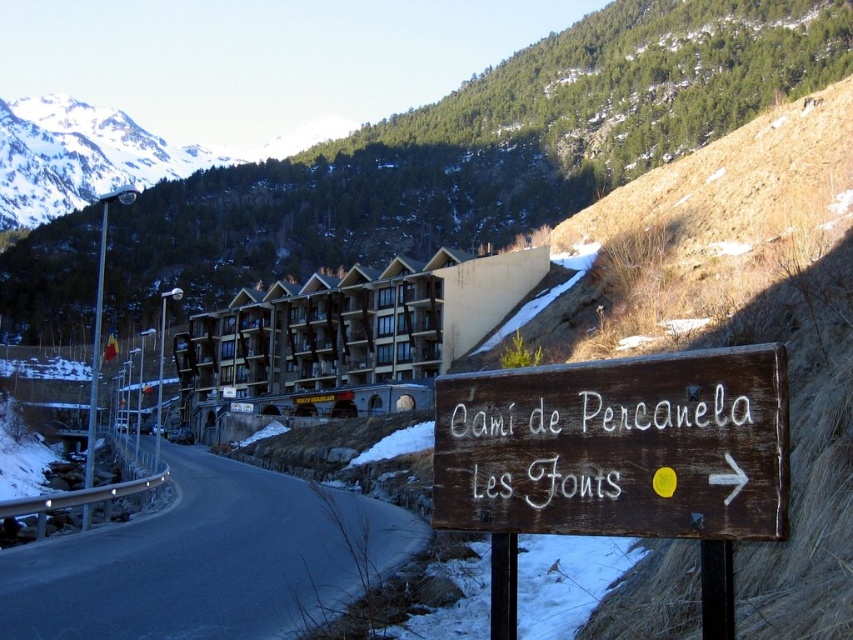
You are a hiker who wants to reach the wooden cabin at center. You see the brown wooden sign at lower right. Which direction should you go relative to the sign to reach the cabin?

The brown wooden sign at lower right is positioned on the right side of the wooden cabin at center, so you should go to the left of the sign to reach the cabin.

You are standing at point A and want to reach the road. The coordinates of point A are given as point A is at point (206, 561). Which direction should you move to reach the road?

A: The black asphalt road at lower left is located at point (206, 561), so you are already at the road.

You are standing at the starting point of the road and see the brown wooden sign at lower right. According to the coordinates provided, is the sign closer to the top or bottom of the image?

The brown wooden sign at lower right is located at point 0.725 on the vertical axis, which is closer to the bottom of the image since lower values on the vertical axis typically correspond to lower positions.